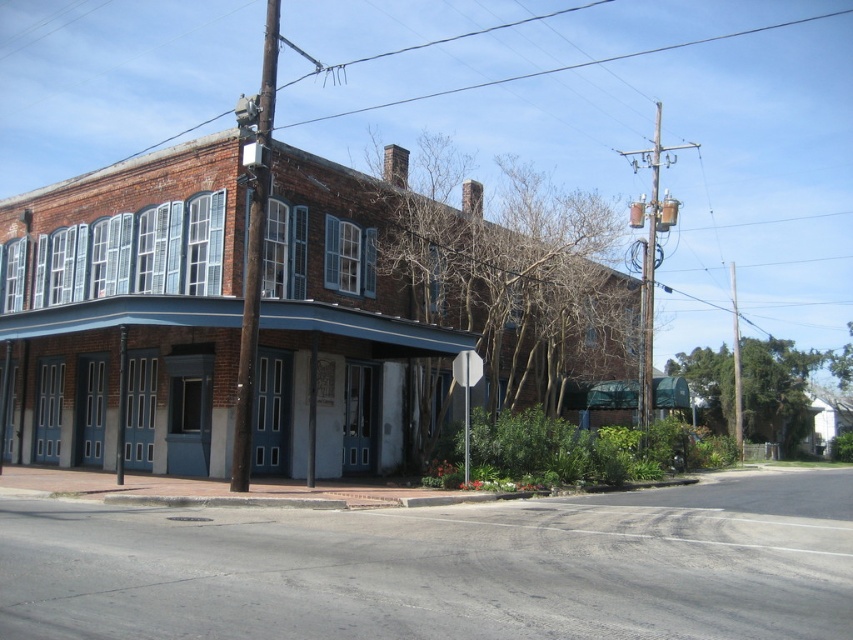
Question: Is brown wooden pole at upper center further to camera compared to white glossy stop sign at center?

Choices:
 (A) no
 (B) yes

Answer: (A)

Question: Which point is farther to the camera?

Choices:
 (A) white glossy stop sign at center
 (B) brown wooden pole at upper center

Answer: (A)

Question: Which object is closer to the camera taking this photo?

Choices:
 (A) brown wooden pole at upper center
 (B) white glossy stop sign at center

Answer: (A)

Question: Is brown wooden pole at upper center further to the viewer compared to white glossy stop sign at center?

Choices:
 (A) yes
 (B) no

Answer: (B)

Question: Does brown wooden pole at upper center have a smaller size compared to white glossy stop sign at center?

Choices:
 (A) no
 (B) yes

Answer: (A)

Question: Which object appears closest to the camera in this image?

Choices:
 (A) brown wooden pole at upper center
 (B) white glossy stop sign at center

Answer: (A)